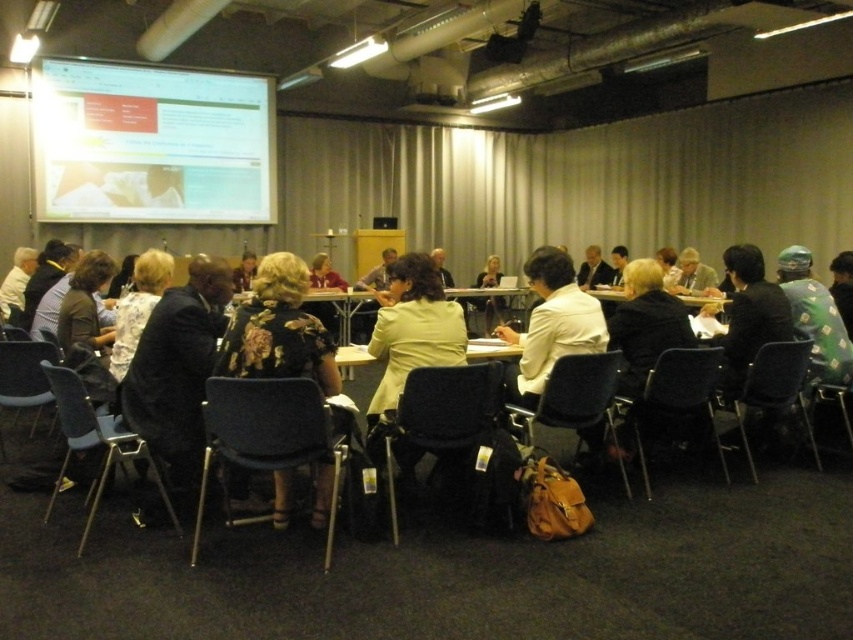
Based on the photo, you are standing at the entrance of the conference room. You need to find the metallic blue chair at lower left. According to the coordinates provided, where exactly is it located?

The metallic blue chair at lower left is located at point [94,442].

You are standing at the point marked as point (x=80, y=541) in the conference room. You want to take a photo of the entire room setup. If your camera has a maximum range of 10 feet, will you be able to capture the entire room from your current position?

The distance between point (x=80, y=541) and the camera is 8.96 feet, which is within the camera maximum range of 10 feet. Therefore, you can capture the entire room from your current position.